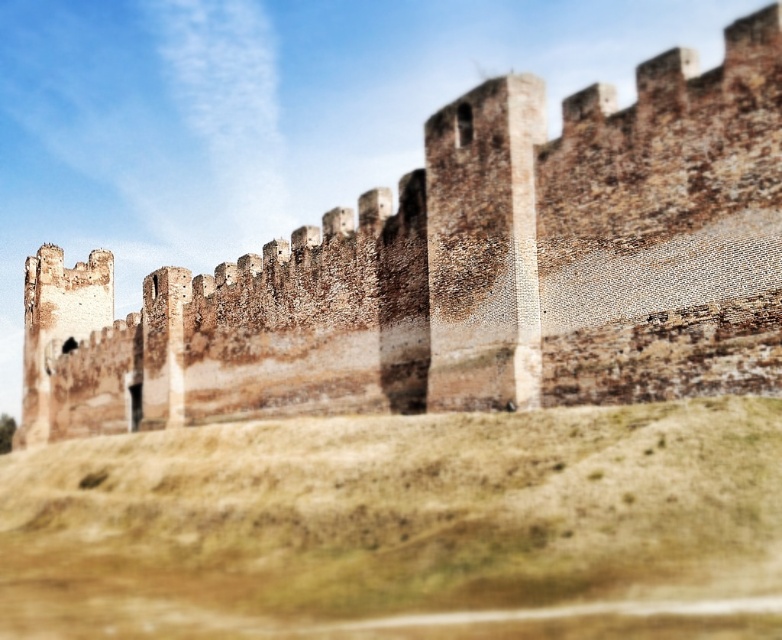
Is point (522, 253) positioned behind point (544, 432)?

Yes.

Is point (490, 337) closer to viewer compared to point (49, 620)?

No, (490, 337) is behind (49, 620).

Does point (278, 412) lie in front of point (669, 532)?

No.

What are the coordinates of `brown stone wall at center` in the screenshot? It's located at (465, 269).